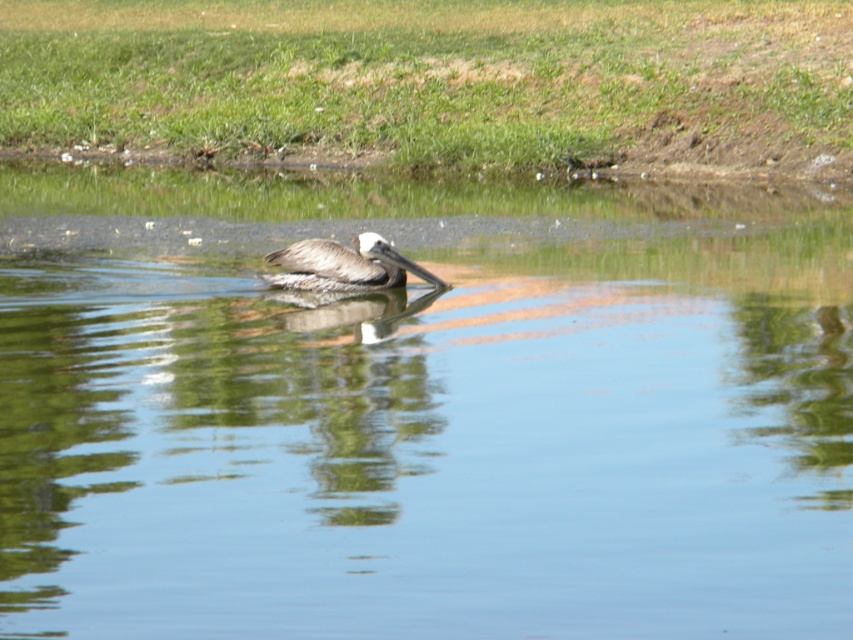
You are a photographer trying to capture the reflection of the brown feathered pelican at center in the clear water at center. Based on the scene, will the reflection be fully visible in the water?

The clear water at center has a greater height compared to the brown feathered pelican at center, so the reflection of the brown feathered pelican at center will be fully visible in the water.